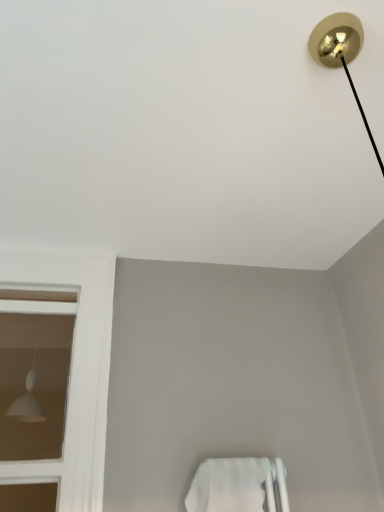
Question: Should I look upward or downward to see white matte lampshade at left?

Choices:
 (A) up
 (B) down

Answer: (B)

Question: Would you say white matte towel bar at lower center is a long distance from white matte lampshade at left?

Choices:
 (A) no
 (B) yes

Answer: (A)

Question: Is white matte towel bar at lower center taller than white matte lampshade at left?

Choices:
 (A) yes
 (B) no

Answer: (B)

Question: Is white matte towel bar at lower center next to white matte lampshade at left?

Choices:
 (A) no
 (B) yes

Answer: (A)

Question: Is white matte towel bar at lower center at the right side of white matte lampshade at left?

Choices:
 (A) yes
 (B) no

Answer: (A)

Question: Can you confirm if white matte towel bar at lower center is shorter than white matte lampshade at left?

Choices:
 (A) yes
 (B) no

Answer: (A)

Question: From a real-world perspective, is white matte towel bar at lower center located beneath white matte lampshade at left?

Choices:
 (A) no
 (B) yes

Answer: (B)

Question: Is white matte lampshade at left positioned behind white matte towel bar at lower center?

Choices:
 (A) no
 (B) yes

Answer: (B)

Question: Is white matte lampshade at left beside white matte towel bar at lower center?

Choices:
 (A) no
 (B) yes

Answer: (A)

Question: Could you tell me if white matte lampshade at left is facing white matte towel bar at lower center?

Choices:
 (A) yes
 (B) no

Answer: (B)

Question: Can you confirm if white matte lampshade at left is taller than white matte towel bar at lower center?

Choices:
 (A) yes
 (B) no

Answer: (A)

Question: From a real-world perspective, is white matte lampshade at left physically above white matte towel bar at lower center?

Choices:
 (A) yes
 (B) no

Answer: (A)

Question: Does white matte lampshade at left come in front of white matte towel bar at lower center?

Choices:
 (A) yes
 (B) no

Answer: (B)

Question: Is white matte towel bar at lower center wider or thinner than white matte lampshade at left?

Choices:
 (A) thin
 (B) wide

Answer: (B)